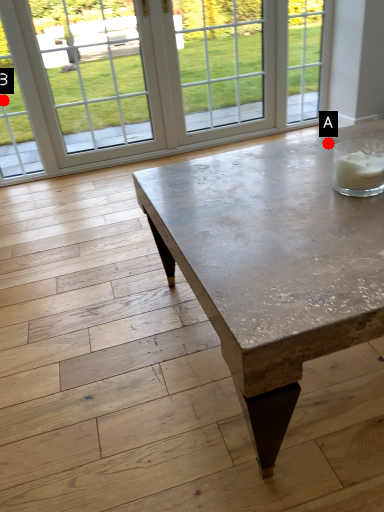
Question: Two points are circled on the image, labeled by A and B beside each circle. Which point is further to the camera?

Choices:
 (A) A is further
 (B) B is further

Answer: (B)